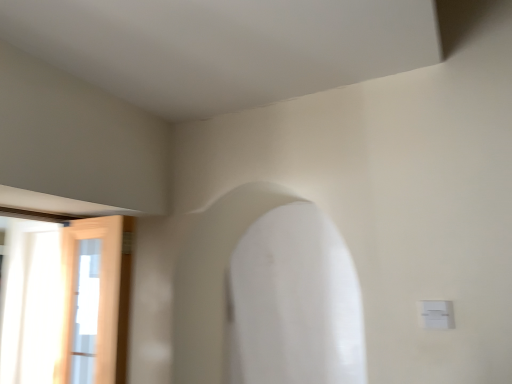
Question: Is white smooth archway at center directly adjacent to white plastic electric outlet at lower right?

Choices:
 (A) yes
 (B) no

Answer: (B)

Question: Is white smooth archway at center closer to the viewer compared to white plastic electric outlet at lower right?

Choices:
 (A) yes
 (B) no

Answer: (B)

Question: Can you confirm if white smooth archway at center is bigger than white plastic electric outlet at lower right?

Choices:
 (A) no
 (B) yes

Answer: (B)

Question: From a real-world perspective, is white smooth archway at center on white plastic electric outlet at lower right?

Choices:
 (A) no
 (B) yes

Answer: (B)

Question: Is white smooth archway at center facing away from white plastic electric outlet at lower right?

Choices:
 (A) no
 (B) yes

Answer: (A)

Question: Is wooden door at left to the left or to the right of white plastic electric outlet at lower right in the image?

Choices:
 (A) right
 (B) left

Answer: (B)

Question: Considering the positions of wooden door at left and white plastic electric outlet at lower right in the image, is wooden door at left wider or thinner than white plastic electric outlet at lower right?

Choices:
 (A) thin
 (B) wide

Answer: (B)

Question: Looking at the image, does wooden door at left seem bigger or smaller compared to white plastic electric outlet at lower right?

Choices:
 (A) small
 (B) big

Answer: (B)

Question: Considering the positions of wooden door at left and white plastic electric outlet at lower right in the image, is wooden door at left taller or shorter than white plastic electric outlet at lower right?

Choices:
 (A) short
 (B) tall

Answer: (B)

Question: From the image's perspective, is wooden door at left above or below white smooth archway at center?

Choices:
 (A) below
 (B) above

Answer: (A)

Question: Would you say wooden door at left is inside or outside white smooth archway at center?

Choices:
 (A) inside
 (B) outside

Answer: (B)

Question: Is point [126, 294] positioned closer to the camera than point [198, 268]?

Choices:
 (A) farther
 (B) closer

Answer: (B)

Question: Is wooden door at left bigger or smaller than white smooth archway at center?

Choices:
 (A) small
 (B) big

Answer: (A)

Question: In terms of height, does white smooth archway at center look taller or shorter compared to wooden door at left?

Choices:
 (A) tall
 (B) short

Answer: (B)

Question: From a real-world perspective, is white smooth archway at center positioned above or below wooden door at left?

Choices:
 (A) below
 (B) above

Answer: (B)